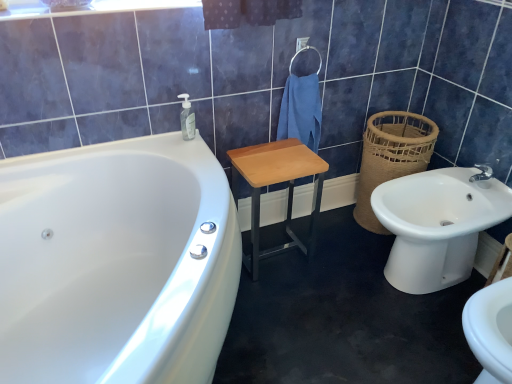
Question: Is brown woven basket at right shorter than white ceramic sink at right?

Choices:
 (A) no
 (B) yes

Answer: (A)

Question: Is brown woven basket at right aimed at white ceramic sink at right?

Choices:
 (A) yes
 (B) no

Answer: (B)

Question: Can we say brown woven basket at right lies outside white ceramic sink at right?

Choices:
 (A) no
 (B) yes

Answer: (B)

Question: Considering the relative sizes of brown woven basket at right and white ceramic sink at right in the image provided, is brown woven basket at right wider than white ceramic sink at right?

Choices:
 (A) no
 (B) yes

Answer: (A)

Question: Considering the relative sizes of brown woven basket at right and white ceramic sink at right in the image provided, is brown woven basket at right bigger than white ceramic sink at right?

Choices:
 (A) yes
 (B) no

Answer: (B)

Question: Is brown woven basket at right positioned far away from white ceramic sink at right?

Choices:
 (A) no
 (B) yes

Answer: (A)

Question: Is white glossy bathtub at left to the left of wooden/matte step stool at center from the viewer's perspective?

Choices:
 (A) yes
 (B) no

Answer: (A)

Question: From the image's perspective, is white glossy bathtub at left beneath wooden/matte step stool at center?

Choices:
 (A) no
 (B) yes

Answer: (B)

Question: Is white glossy bathtub at left surrounding wooden/matte step stool at center?

Choices:
 (A) no
 (B) yes

Answer: (A)

Question: Can you confirm if white glossy bathtub at left is positioned to the right of wooden/matte step stool at center?

Choices:
 (A) no
 (B) yes

Answer: (A)

Question: Is white glossy bathtub at left directly adjacent to wooden/matte step stool at center?

Choices:
 (A) no
 (B) yes

Answer: (A)

Question: Is white glossy bathtub at left taller than wooden/matte step stool at center?

Choices:
 (A) yes
 (B) no

Answer: (A)

Question: Is blue cotton towel at center completely or partially inside white ceramic sink at right?

Choices:
 (A) yes
 (B) no

Answer: (B)